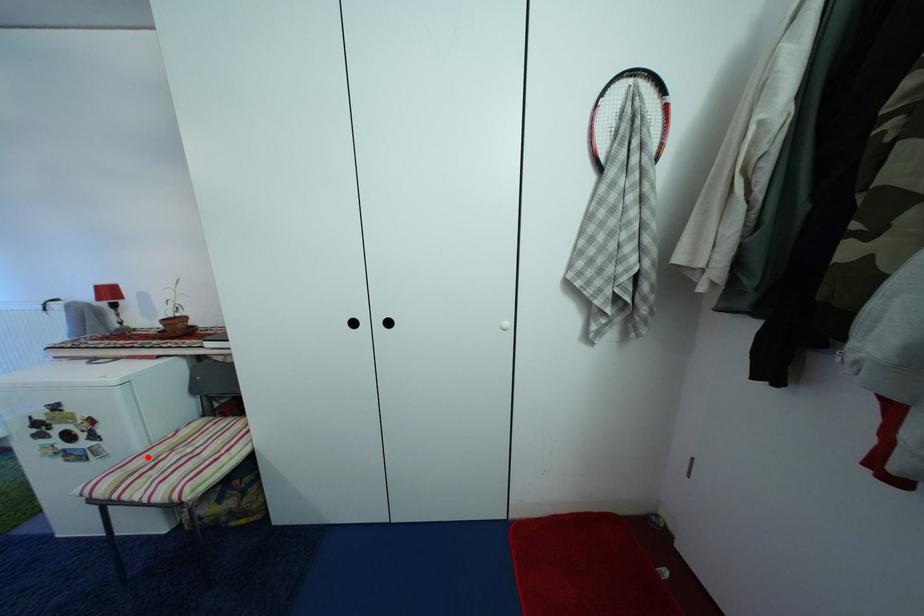
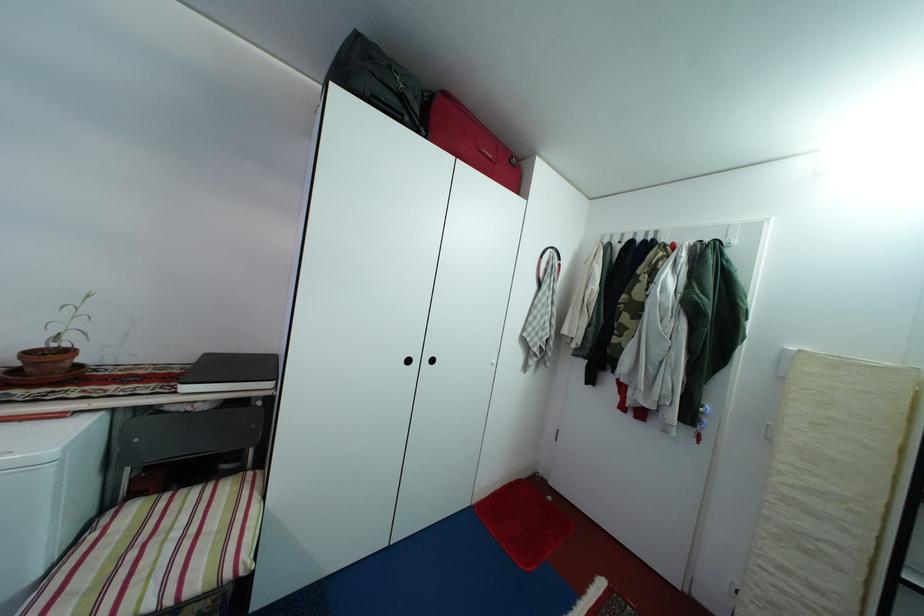
Locate, in the second image, the point that corresponds to the highlighted location in the first image.

(47, 581)